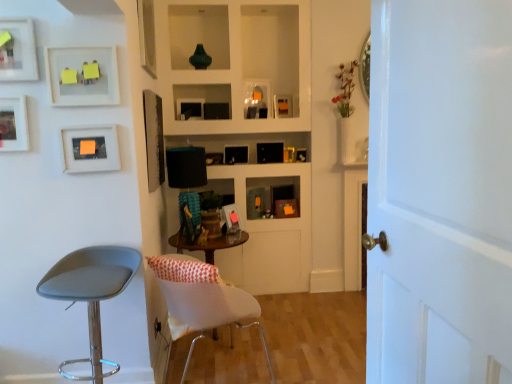
Question: Is matte orange paper at upper left, arranged as the 4th picture frame when viewed from the front, further to the viewer compared to matte white picture frame at upper left, acting as the 2th picture frame starting from the front?

Choices:
 (A) yes
 (B) no

Answer: (A)

Question: Would you say matte orange paper at upper left, arranged as the 4th picture frame when viewed from the front, is a long distance from matte white picture frame at upper left, which is the ninth picture frame in back-to-front order?

Choices:
 (A) yes
 (B) no

Answer: (B)

Question: From a real-world perspective, is matte orange paper at upper left, arranged as the 4th picture frame when viewed from the front, physically above matte white picture frame at upper left, acting as the 2th picture frame starting from the front?

Choices:
 (A) no
 (B) yes

Answer: (A)

Question: Is matte orange paper at upper left, arranged as the 4th picture frame when viewed from the front, taller than matte white picture frame at upper left, acting as the 2th picture frame starting from the front?

Choices:
 (A) yes
 (B) no

Answer: (B)

Question: Can you confirm if matte orange paper at upper left, arranged as the 4th picture frame when viewed from the front, is thinner than matte white picture frame at upper left, acting as the 2th picture frame starting from the front?

Choices:
 (A) no
 (B) yes

Answer: (A)

Question: From the image's perspective, is matte orange paper at upper left, the 7th picture frame from the back, on matte white picture frame at upper left, which is the ninth picture frame in back-to-front order?

Choices:
 (A) yes
 (B) no

Answer: (B)

Question: Is matte white picture frame at upper left, the 1th picture frame viewed from the front, not inside matte white picture frame at upper left, acting as the 2th picture frame starting from the front?

Choices:
 (A) yes
 (B) no

Answer: (A)

Question: Considering the relative sizes of matte white picture frame at upper left, which is the 10th picture frame from back to front, and matte white picture frame at upper left, acting as the 2th picture frame starting from the front, in the image provided, is matte white picture frame at upper left, which is the 10th picture frame from back to front, thinner than matte white picture frame at upper left, acting as the 2th picture frame starting from the front,?

Choices:
 (A) no
 (B) yes

Answer: (A)

Question: Is matte white picture frame at upper left, which is the ninth picture frame in back-to-front order, surrounded by matte white picture frame at upper left, which is the 10th picture frame from back to front?

Choices:
 (A) yes
 (B) no

Answer: (B)

Question: Is matte white picture frame at upper left, the 1th picture frame viewed from the front, aimed at matte white picture frame at upper left, acting as the 2th picture frame starting from the front?

Choices:
 (A) yes
 (B) no

Answer: (B)

Question: From the image's perspective, would you say matte white picture frame at upper left, the 1th picture frame viewed from the front, is shown under matte white picture frame at upper left, acting as the 2th picture frame starting from the front?

Choices:
 (A) yes
 (B) no

Answer: (B)

Question: Is matte white picture frame at upper left, the 1th picture frame viewed from the front, positioned far away from matte white picture frame at upper left, acting as the 2th picture frame starting from the front?

Choices:
 (A) no
 (B) yes

Answer: (A)

Question: From the image's perspective, is matte white picture frame at upper left, which is the ninth picture frame in back-to-front order, over matte black picture frame at center, arranged as the 6th picture frame when viewed from the front?

Choices:
 (A) yes
 (B) no

Answer: (A)